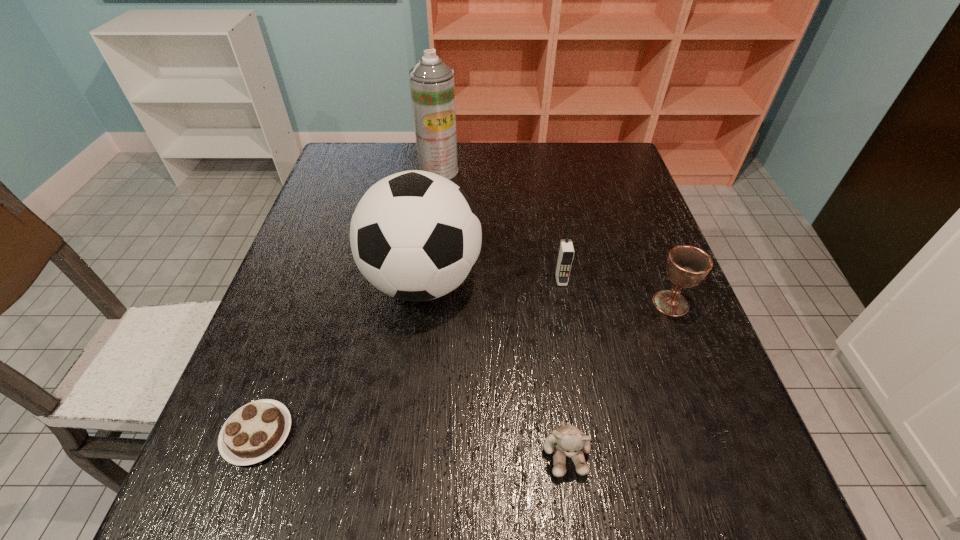
Identify the location of the farthest object. (432, 86).

Locate an element on the screen. This screenshot has width=960, height=540. aerosol can is located at coordinates (432, 86).

The image size is (960, 540). I want to click on the fifth shortest object, so click(415, 236).

The height and width of the screenshot is (540, 960). Identify the location of the fourth shortest object. [566, 252].

Locate an element on the screen. chalice is located at coordinates (687, 265).

Identify the location of the third shortest object. The height and width of the screenshot is (540, 960). (687, 265).

Identify the location of the second shortest object. (568, 440).

Image resolution: width=960 pixels, height=540 pixels. Find the location of `chocolate cake`. chocolate cake is located at coordinates (255, 431).

Where is `the shortest object`? The image size is (960, 540). the shortest object is located at coordinates click(x=255, y=431).

Find the location of `free location located 0.080m on the right of the aerosol can`. free location located 0.080m on the right of the aerosol can is located at coordinates (485, 171).